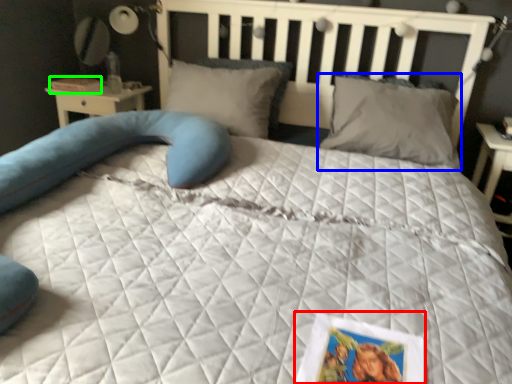
Question: Based on their relative distances, which object is farther from postcard (highlighted by a red box)? Choose from pillow (highlighted by a blue box) and book (highlighted by a green box).

Choices:
 (A) pillow
 (B) book

Answer: (B)